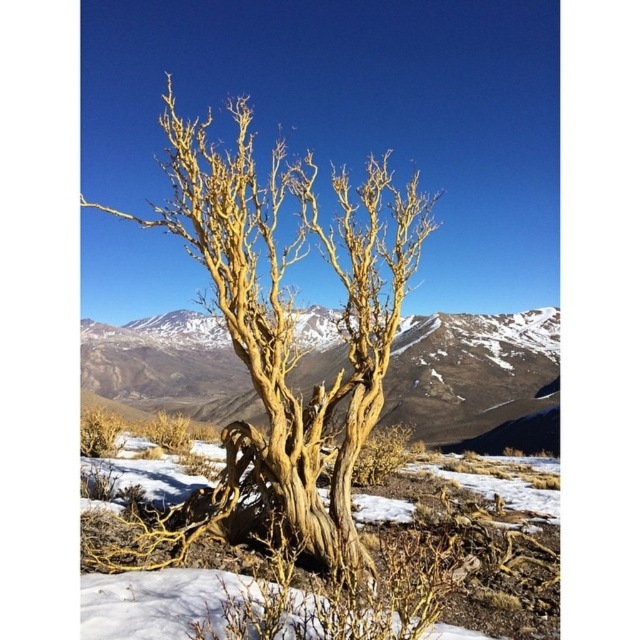
You are an artist sketching this scene and need to place both the golden textured tree at center and the light brown bark tree at center accurately. According to the spatial arrangement, which tree should you draw on the right side?

The golden textured tree at center should be drawn on the right side of the light brown bark tree at center because the golden textured tree at center is positioned on the right side of light brown bark tree at center.

You are standing in the natural landscape scene looking at the two points marked. Which point is nearer to you, point (x=241, y=344) or point (x=524, y=317)?

Point (x=241, y=344) is closer to the viewer than point (x=524, y=317).